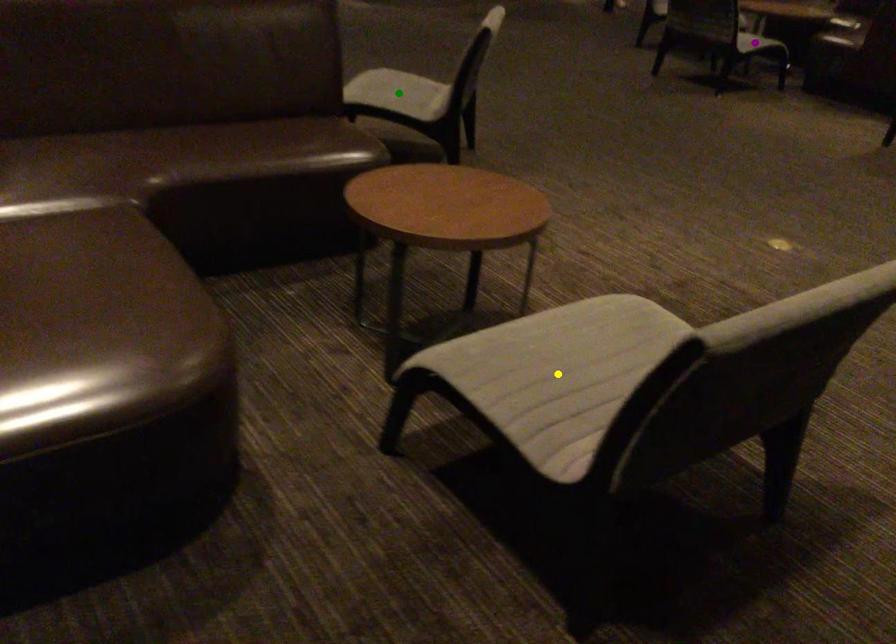
Order these from farthest to nearest:
green point, yellow point, purple point

purple point < green point < yellow point